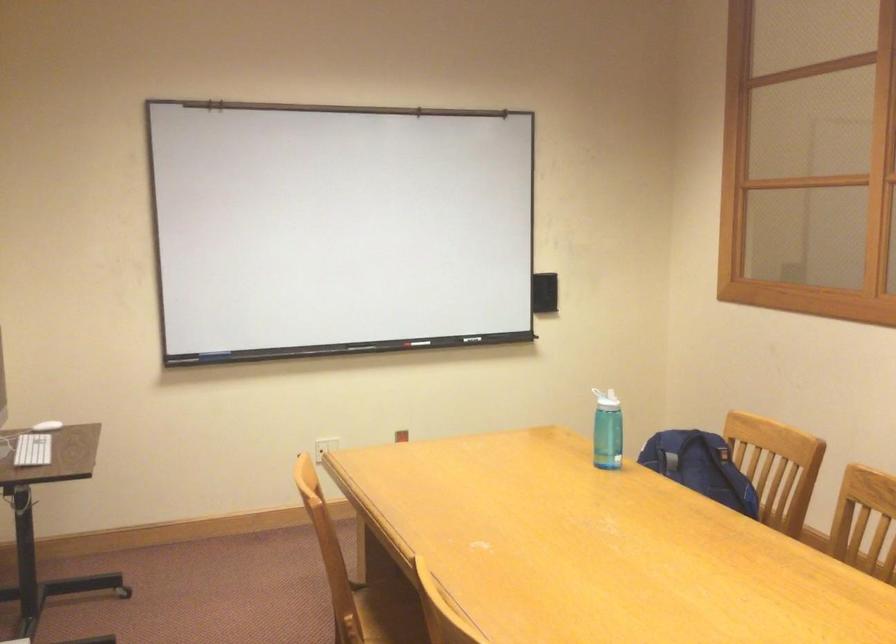
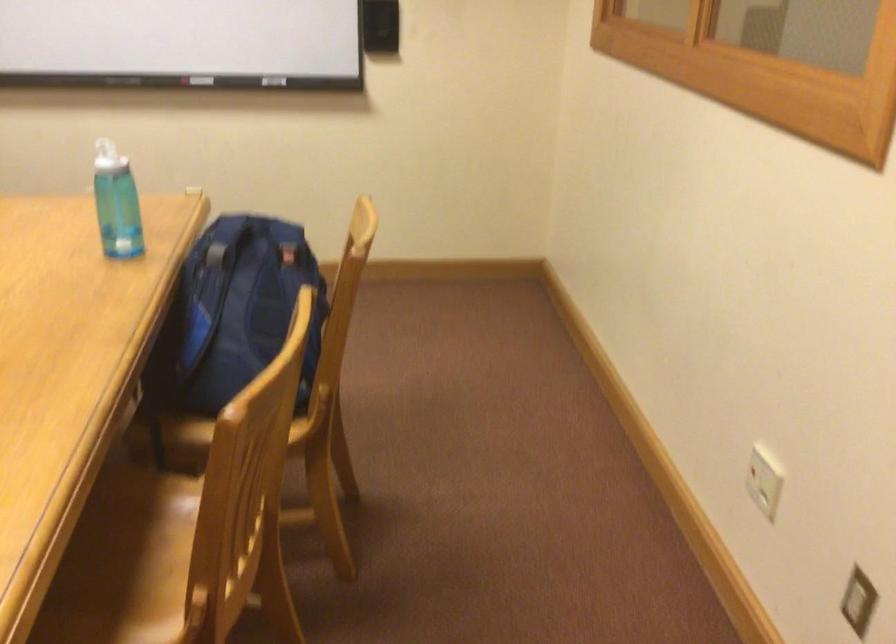
Question: I am providing you with two images of the same scene from different viewpoints. After the viewpoint changes to image2, which objects are now occluded?

Choices:
 (A) blue game controller
 (B) blue water bottle
 (C) white bottle lid
 (D) chair sitting surface

Answer: (C)